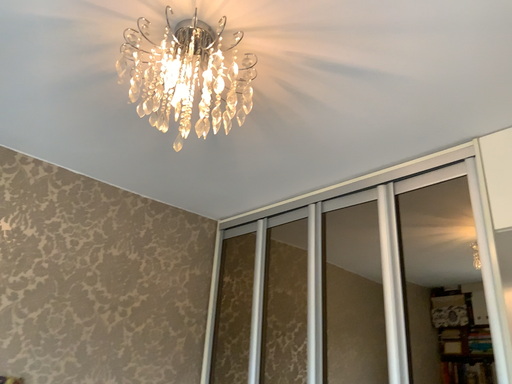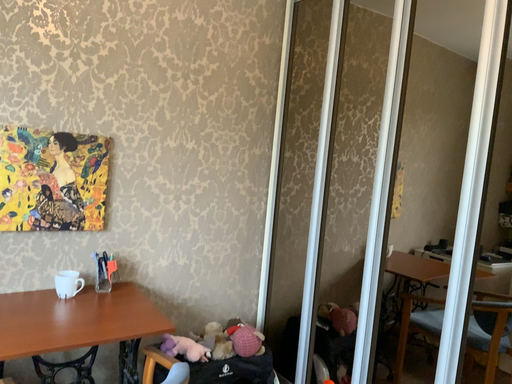
Question: Which way did the camera rotate in the video?

Choices:
 (A) rotated left
 (B) rotated right

Answer: (A)